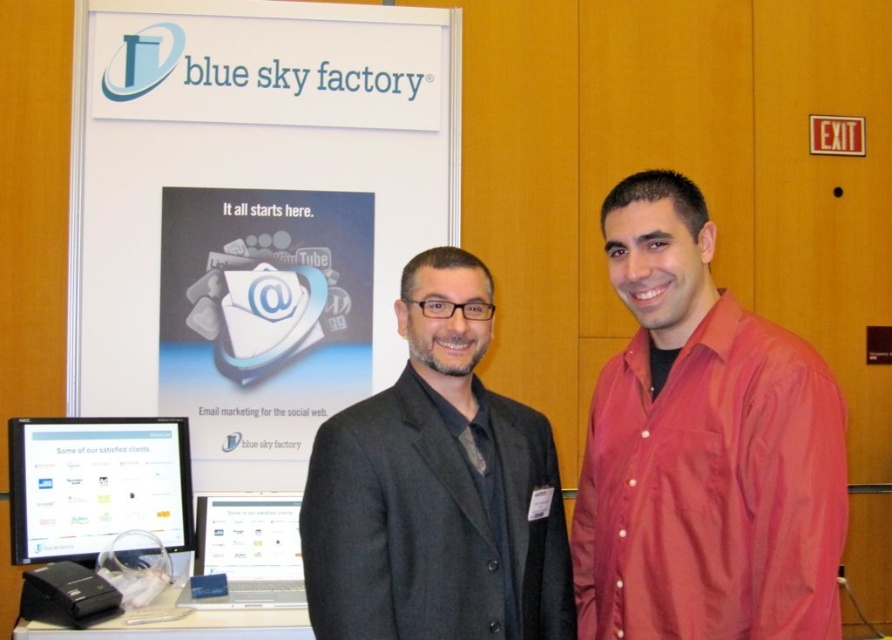
Question: Based on their relative distances, which object is farther from the matte black monitor at lower left?

Choices:
 (A) dark gray suit at center
 (B) satin silver laptop at center
 (C) white paperboard at upper center

Answer: (A)

Question: Can you confirm if white paperboard at upper center is smaller than satin silver laptop at center?

Choices:
 (A) yes
 (B) no

Answer: (B)

Question: Is red satin shirt at right above matte black monitor at lower left?

Choices:
 (A) no
 (B) yes

Answer: (B)

Question: In this image, where is dark gray suit at center located relative to satin silver laptop at center?

Choices:
 (A) below
 (B) above

Answer: (B)

Question: Which object is positioned farthest from the matte black monitor at lower left?

Choices:
 (A) red satin shirt at right
 (B) satin silver laptop at center
 (C) dark gray suit at center
 (D) white paperboard at upper center

Answer: (A)

Question: Which point is closer to the camera?

Choices:
 (A) (505, 493)
 (B) (121, 438)

Answer: (A)